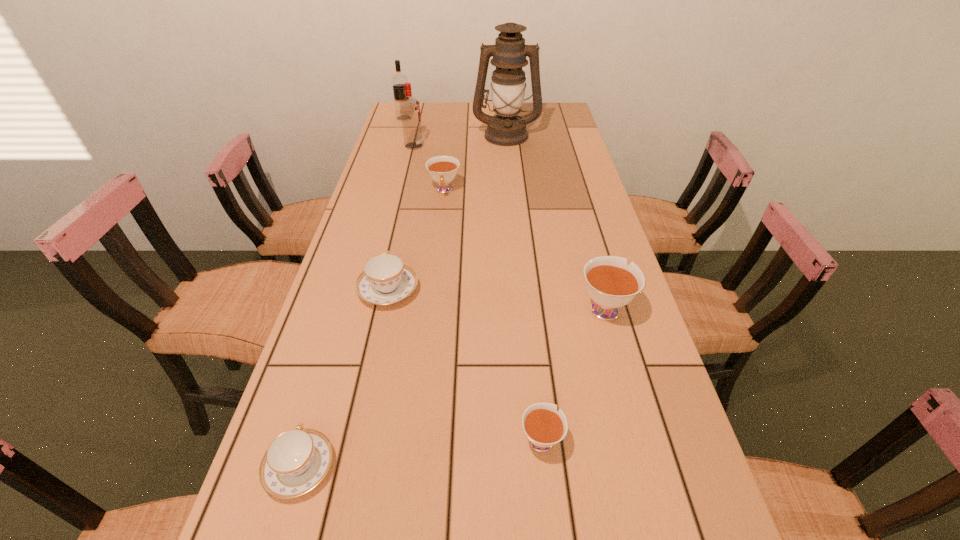
The image size is (960, 540). Find the location of `vacant space that is in between the farther vodka and the tallest teacup`. vacant space that is in between the farther vodka and the tallest teacup is located at coordinates (504, 213).

This screenshot has width=960, height=540. Find the location of `vacant space that is in between the nearer blue teacup and the smallest white teacup`. vacant space that is in between the nearer blue teacup and the smallest white teacup is located at coordinates (420, 453).

You are a GUI agent. You are given a task and a screenshot of the screen. Output one action in this format:
    pyautogui.click(x=<x>, y=<y>)
    Task: Click on the free area in between the brown oil lamp and the bigger blue teacup
    The height and width of the screenshot is (540, 960).
    Given the screenshot: What is the action you would take?
    pyautogui.click(x=447, y=213)

Locate an element on the screen. This screenshot has width=960, height=540. free area in between the second smallest white teacup and the nearer blue teacup is located at coordinates (372, 329).

The height and width of the screenshot is (540, 960). In order to click on free space between the rightmost teacup and the leftmost white teacup in this screenshot , I will do `click(524, 249)`.

Where is `object that is the fourth nearest to the farther vodka`? object that is the fourth nearest to the farther vodka is located at coordinates tap(385, 280).

Select which object is the second closest to the second white teacup from right to left. Please provide its 2D coordinates. Your answer should be formatted as a tuple, i.e. [(x, y)], where the tuple contains the x and y coordinates of a point satisfying the conditions above.

[(297, 460)]

Select which teacup is the third closest to the farther blue teacup. Please provide its 2D coordinates. Your answer should be formatted as a tuple, i.e. [(x, y)], where the tuple contains the x and y coordinates of a point satisfying the conditions above.

[(544, 427)]

Locate which teacup ranks third in proximity to the nearest white teacup. Please provide its 2D coordinates. Your answer should be formatted as a tuple, i.e. [(x, y)], where the tuple contains the x and y coordinates of a point satisfying the conditions above.

[(385, 280)]

Point out which white teacup is positioned as the nearest to the fourth farthest object. Please provide its 2D coordinates. Your answer should be formatted as a tuple, i.e. [(x, y)], where the tuple contains the x and y coordinates of a point satisfying the conditions above.

[(611, 284)]